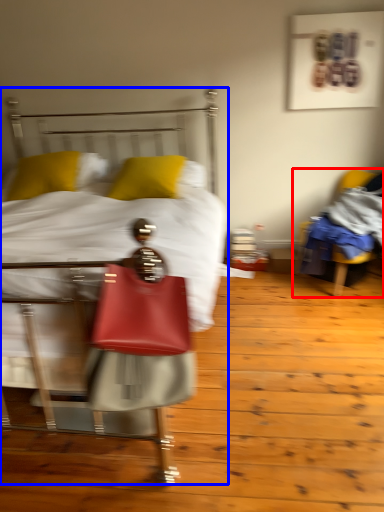
Question: Which point is further to the camera, chair (highlighted by a red box) or bed (highlighted by a blue box)?

Choices:
 (A) chair
 (B) bed

Answer: (A)